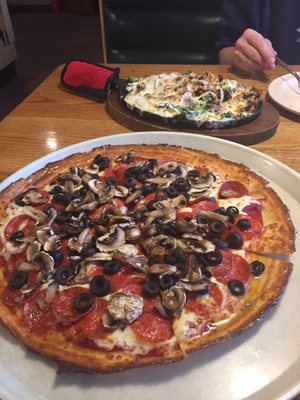
Image resolution: width=300 pixels, height=400 pixels. Find the location of `wooden plate`. wooden plate is located at coordinates (254, 128).